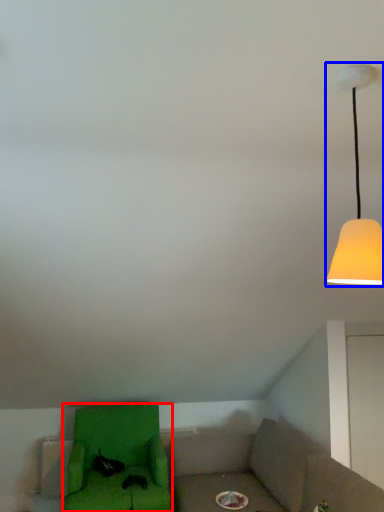
Question: Among these objects, which one is farthest to the camera, furniture (highlighted by a red box) or lamp (highlighted by a blue box)?

Choices:
 (A) furniture
 (B) lamp

Answer: (A)